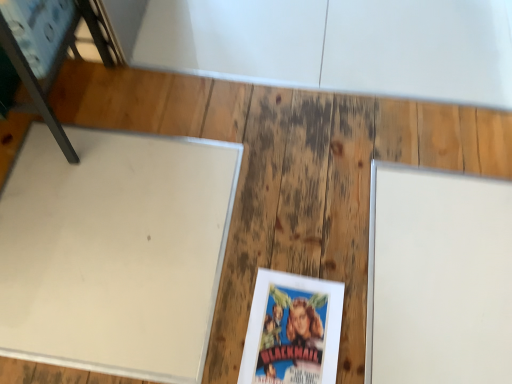
This screenshot has width=512, height=384. Find the location of `vacant space behind matte paper book at center`. vacant space behind matte paper book at center is located at coordinates (286, 236).